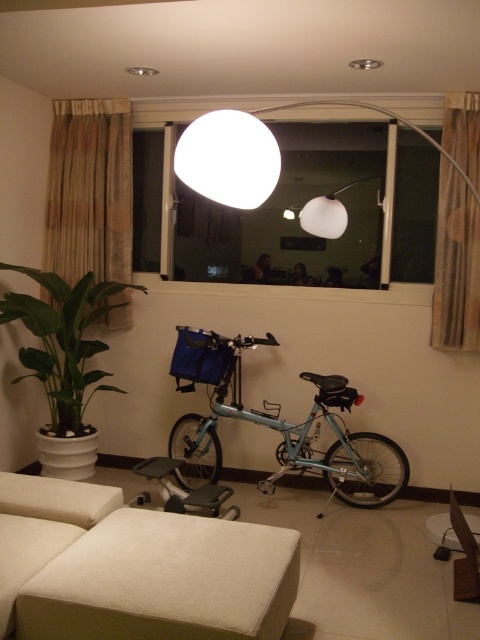
You are standing in the living room and want to place a new painting on the wall. The painting is 1.2 meters wide and needs to be centered exactly where the light blue metallic bicycle at center is currently located. Is there enough space on the wall to place the painting without overlapping any other objects?

The light blue metallic bicycle at center is located at point coordinates (278, 426). Since the painting needs to be centered at this exact point and the description does not mention any other objects near this location, there is likely enough space to place the painting without overlapping other objects.

In the scene shown: You are standing in the living room and want to place a 1.5 meter long rug between the beige fabric ottoman at lower center and the sofa. Is there enough space?

The beige fabric ottoman at lower center is 1.75 meters away from the camera, so there is enough space to place a 1.5 meter long rug between it and the sofa.

You are arranging a small table between the green glossy plant at left and the white fabric stool at lower right. Which object should the table be placed closer to if you want it to be proportionally sized to both?

The table should be placed closer to the white fabric stool at lower right because the green glossy plant at left is bigger than the white fabric stool at lower right, so the table needs to be nearer to the smaller object to maintain proportion.